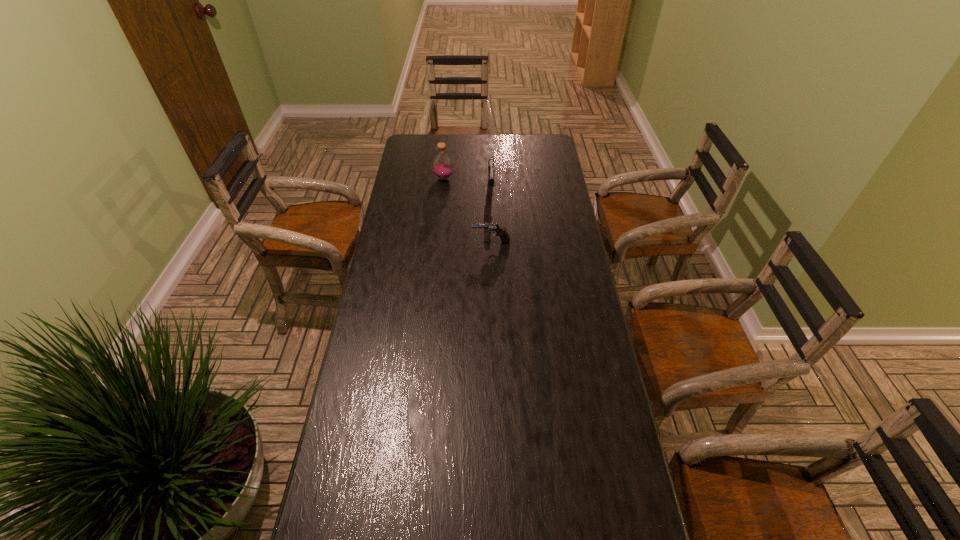
In order to click on the leftmost object in this screenshot , I will do `click(442, 165)`.

At what (x,y) coordinates should I click in order to perform the action: click on bottle. Please return your answer as a coordinate pair (x, y). The height and width of the screenshot is (540, 960). Looking at the image, I should click on (442, 165).

You are a GUI agent. You are given a task and a screenshot of the screen. Output one action in this format:
    pyautogui.click(x=<x>, y=<y>)
    Task: Click on the second shortest object
    
    Given the screenshot: What is the action you would take?
    pyautogui.click(x=491, y=170)

Where is `the taller pistol`? This screenshot has height=540, width=960. the taller pistol is located at coordinates (491, 170).

I want to click on the shortest object, so click(x=489, y=227).

Identify the location of the nearest object. (489, 227).

I want to click on vacant space located 0.100m on the right of the bottle, so click(476, 178).

Image resolution: width=960 pixels, height=540 pixels. In order to click on vacant space located aim along the barrel of the farther pistol in this screenshot , I will do `click(492, 222)`.

At what (x,y) coordinates should I click in order to perform the action: click on vacant position located 0.150m at the barrel of the shortest object. Please return your answer as a coordinate pair (x, y). Looking at the image, I should click on (434, 242).

Locate an element on the screen. The image size is (960, 540). free space located 0.070m at the barrel of the shortest object is located at coordinates (454, 242).